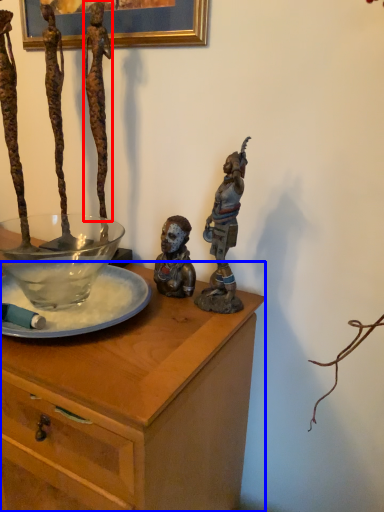
Question: Which object appears farthest to the camera in this image, person (highlighted by a red box) or desk (highlighted by a blue box)?

Choices:
 (A) person
 (B) desk

Answer: (A)